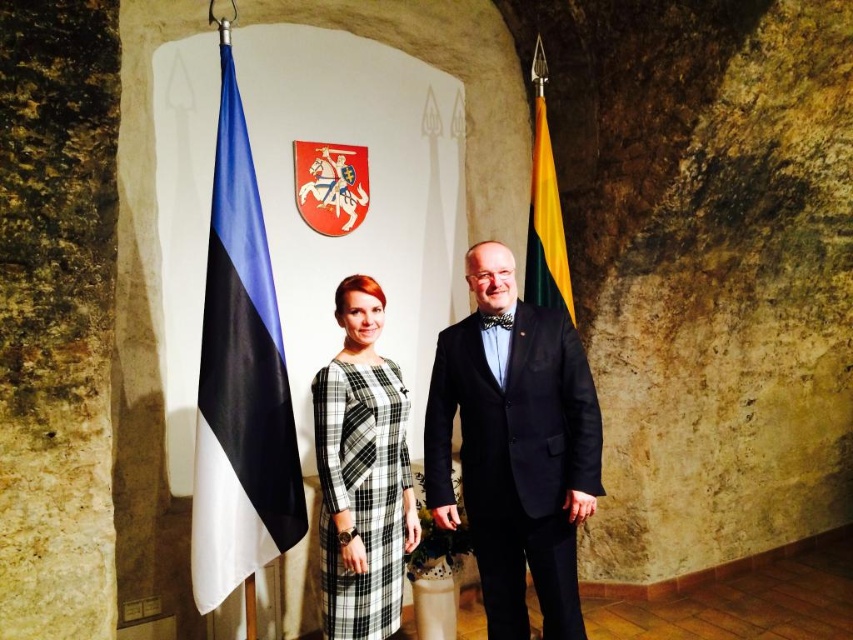
Which object is located at the coordinates point (x=515, y=445)?

The black satin suit at center is located at point (x=515, y=445).

You are a photographer adjusting your camera to focus on two points in the scene. The first point is at coordinates point (480, 369) and the second is at point (401, 577). Which point should you focus on first if you want to capture the closest one to the camera?

Point (480, 369) is closer to the viewer than point (401, 577), so you should focus on point (480, 369) first.